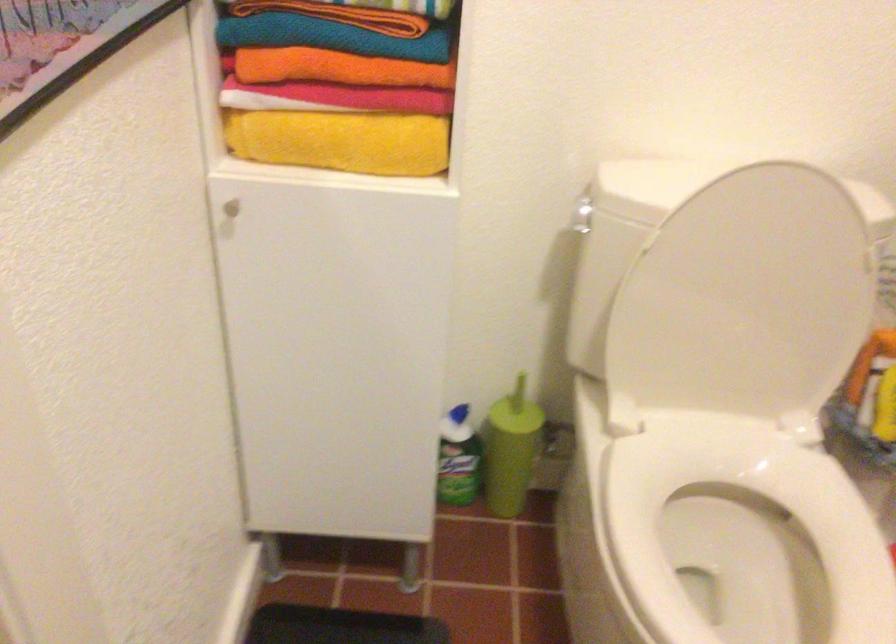
Find where to lift the green toilet brush. Please return your answer as a coordinate pair (x, y).

(511, 450)